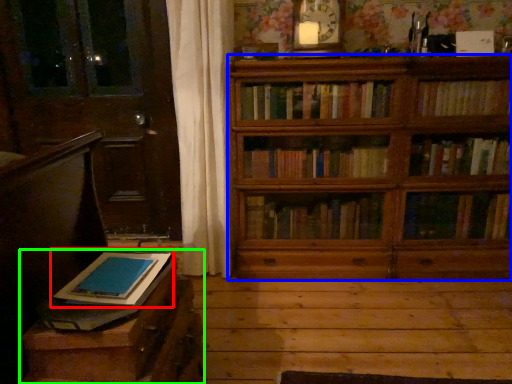
Question: Considering the real-world distances, which object is closest to book (highlighted by a red box)? bookcase (highlighted by a blue box) or table (highlighted by a green box).

Choices:
 (A) bookcase
 (B) table

Answer: (B)